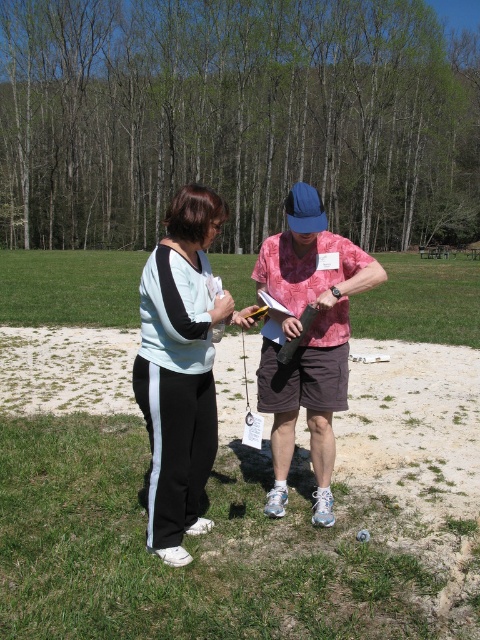
Question: Is light blue cotton sweatshirt at center smaller than pink tie-dye shirt at center?

Choices:
 (A) no
 (B) yes

Answer: (B)

Question: Which of the following is the farthest from the observer?

Choices:
 (A) pink tie-dye shirt at center
 (B) light blue cotton sweatshirt at center

Answer: (A)

Question: Observing the image, what is the correct spatial positioning of light blue cotton sweatshirt at center in reference to pink tie-dye shirt at center?

Choices:
 (A) above
 (B) below

Answer: (A)

Question: Which point is farther from the camera taking this photo?

Choices:
 (A) (180, 358)
 (B) (300, 186)

Answer: (B)

Question: Does light blue cotton sweatshirt at center have a lesser width compared to pink tie-dye shirt at center?

Choices:
 (A) yes
 (B) no

Answer: (A)